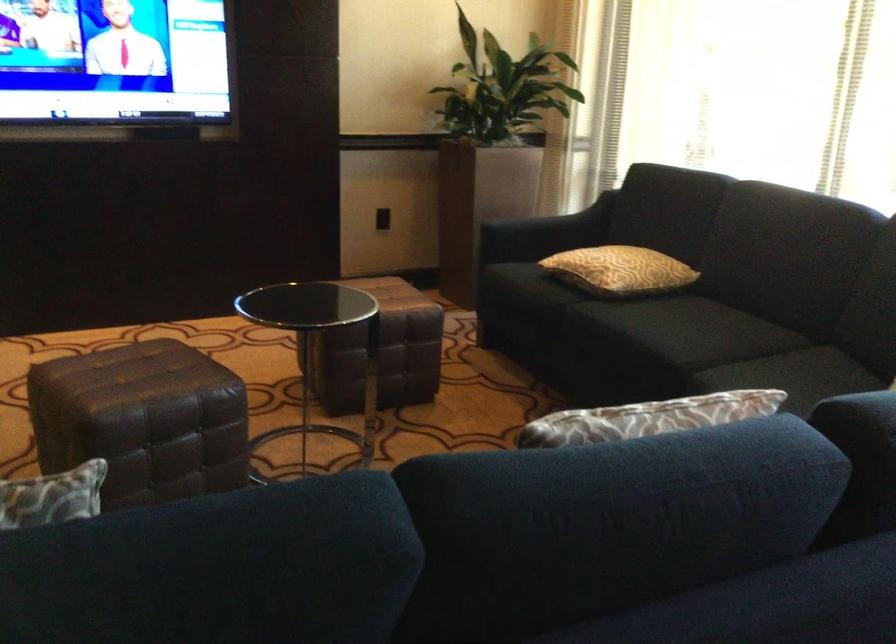
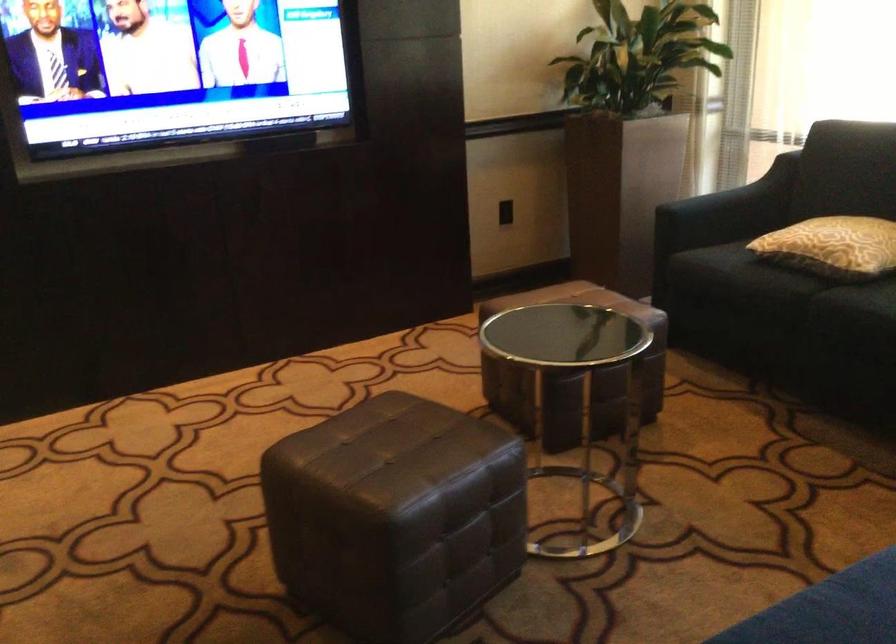
Find the pixel in the second image that matches the point at 352,348 in the first image.

(573, 373)